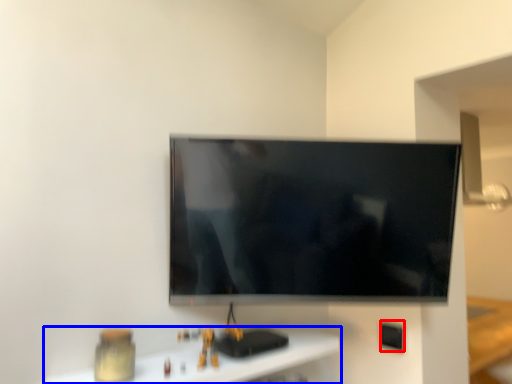
Question: Which point is further to the camera, electric outlet (highlighted by a red box) or furniture (highlighted by a blue box)?

Choices:
 (A) electric outlet
 (B) furniture

Answer: (A)